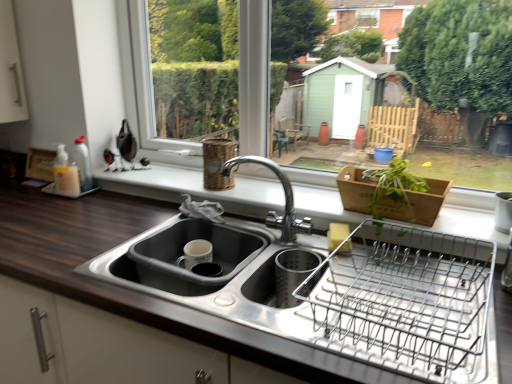
Question: Is the position of woven brown basket at upper center less distant than that of matte gray sink at lower center?

Choices:
 (A) no
 (B) yes

Answer: (A)

Question: Can you confirm if woven brown basket at upper center is thinner than matte gray sink at lower center?

Choices:
 (A) no
 (B) yes

Answer: (B)

Question: Does woven brown basket at upper center come behind matte gray sink at lower center?

Choices:
 (A) yes
 (B) no

Answer: (A)

Question: From a real-world perspective, is woven brown basket at upper center on top of matte gray sink at lower center?

Choices:
 (A) no
 (B) yes

Answer: (B)

Question: Does woven brown basket at upper center have a smaller size compared to matte gray sink at lower center?

Choices:
 (A) yes
 (B) no

Answer: (A)

Question: Considering the positions of white plastic window frame at upper center and woven brown basket at upper center in the image, is white plastic window frame at upper center bigger or smaller than woven brown basket at upper center?

Choices:
 (A) big
 (B) small

Answer: (A)

Question: In terms of width, does white plastic window frame at upper center look wider or thinner when compared to woven brown basket at upper center?

Choices:
 (A) wide
 (B) thin

Answer: (B)

Question: Is white plastic window frame at upper center in front of or behind woven brown basket at upper center in the image?

Choices:
 (A) behind
 (B) front

Answer: (B)

Question: From the image's perspective, relative to woven brown basket at upper center, is white plastic window frame at upper center above or below?

Choices:
 (A) above
 (B) below

Answer: (A)

Question: From a real-world perspective, is chrome metallic faucet at center above or below white plastic window frame at upper center?

Choices:
 (A) below
 (B) above

Answer: (A)

Question: In the image, is chrome metallic faucet at center positioned in front of or behind white plastic window frame at upper center?

Choices:
 (A) front
 (B) behind

Answer: (A)

Question: From the image's perspective, is chrome metallic faucet at center positioned above or below white plastic window frame at upper center?

Choices:
 (A) below
 (B) above

Answer: (A)

Question: Is chrome metallic faucet at center inside or outside of white plastic window frame at upper center?

Choices:
 (A) outside
 (B) inside

Answer: (A)

Question: In terms of size, does chrome metallic faucet at center appear bigger or smaller than wooden basket at center?

Choices:
 (A) big
 (B) small

Answer: (B)

Question: Is chrome metallic faucet at center in front of or behind wooden basket at center in the image?

Choices:
 (A) behind
 (B) front

Answer: (B)